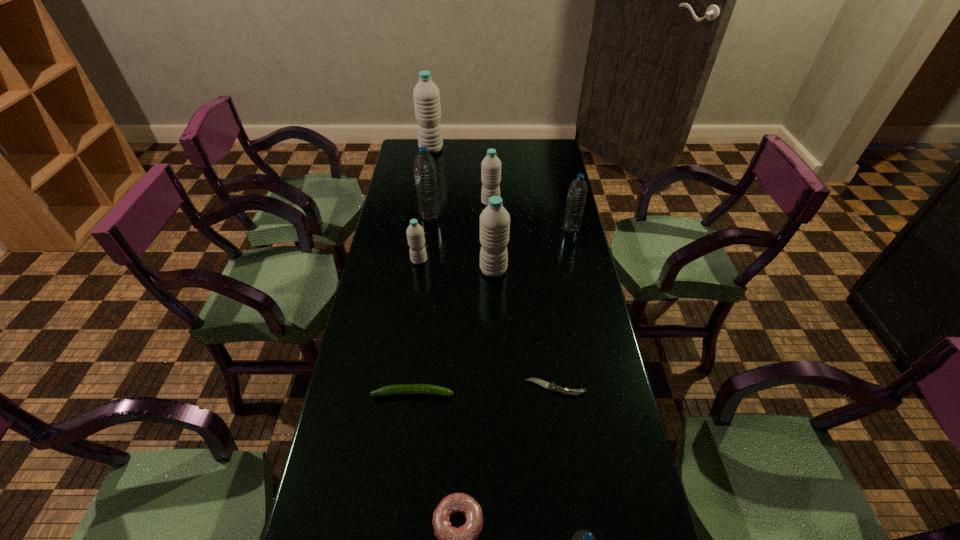
In order to click on the tallest water bottle in this screenshot , I will do `click(426, 94)`.

You are a GUI agent. You are given a task and a screenshot of the screen. Output one action in this format:
    pyautogui.click(x=<x>, y=<y>)
    Task: Click on the biggest white water bottle
    The width and height of the screenshot is (960, 540).
    Given the screenshot: What is the action you would take?
    pyautogui.click(x=426, y=94)

Image resolution: width=960 pixels, height=540 pixels. In order to click on the second biggest white water bottle in this screenshot , I will do `click(494, 220)`.

Identify the location of the leftmost blue water bottle. The image size is (960, 540). (425, 172).

This screenshot has width=960, height=540. In order to click on the third farthest water bottle in this screenshot , I will do (425, 172).

The height and width of the screenshot is (540, 960). I want to click on the rightmost blue water bottle, so click(577, 193).

The height and width of the screenshot is (540, 960). Find the location of `the seventh nearest object`. the seventh nearest object is located at coordinates (577, 193).

The image size is (960, 540). In order to click on the third biggest white water bottle in this screenshot , I will do `click(491, 165)`.

Locate an element on the screen. This screenshot has width=960, height=540. the ninth nearest object is located at coordinates (491, 165).

You are a GUI agent. You are given a task and a screenshot of the screen. Output one action in this format:
    pyautogui.click(x=<x>, y=<y>)
    Task: Click on the smallest white water bottle
    This screenshot has height=540, width=960.
    Given the screenshot: What is the action you would take?
    pyautogui.click(x=415, y=234)